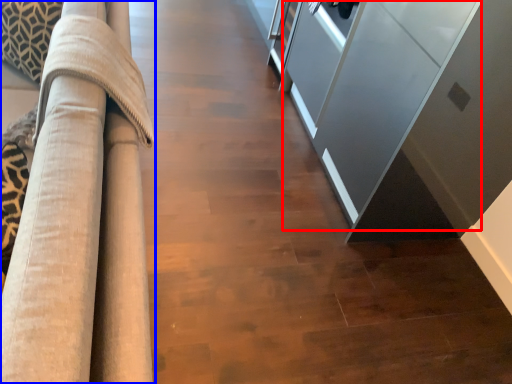
Question: Which object is closer to the camera taking this photo, glass door (highlighted by a red box) or furniture (highlighted by a blue box)?

Choices:
 (A) glass door
 (B) furniture

Answer: (B)